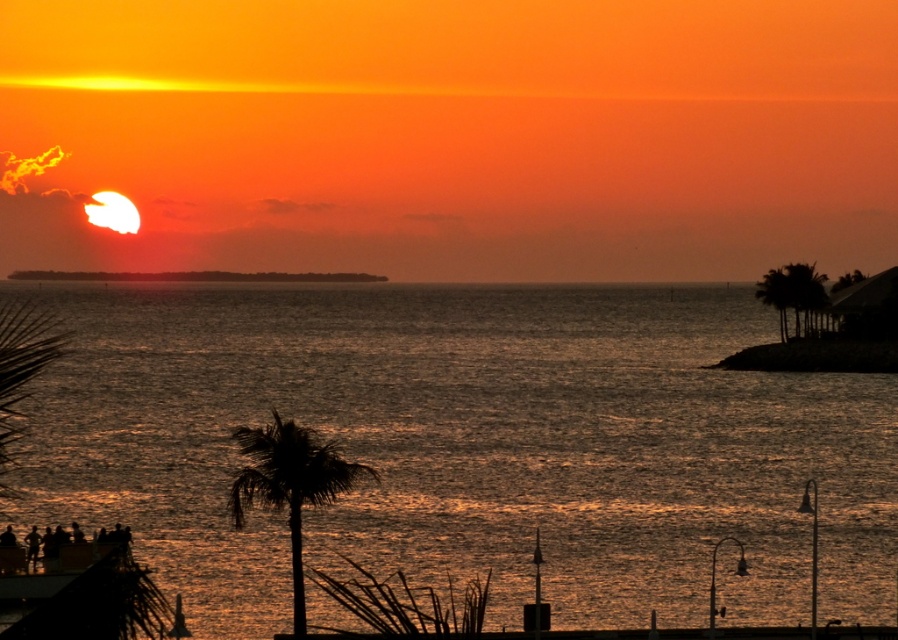
Question: Does shiny metallic water at center appear on the left side of green leafy palm tree at right?

Choices:
 (A) no
 (B) yes

Answer: (B)

Question: Which point is closer to the camera taking this photo?

Choices:
 (A) (521, 460)
 (B) (280, 435)

Answer: (B)

Question: Does shiny metallic water at center have a lesser width compared to green leafy palm tree at right?

Choices:
 (A) no
 (B) yes

Answer: (A)

Question: Which point is closer to the camera?

Choices:
 (A) (320, 611)
 (B) (824, 305)

Answer: (A)

Question: Which object appears farthest from the camera in this image?

Choices:
 (A) shiny metallic water at center
 (B) silhouette leafy palm at lower center

Answer: (A)

Question: Does silhouette leafy palm at lower center have a lesser width compared to green leafy palm tree at right?

Choices:
 (A) no
 (B) yes

Answer: (A)